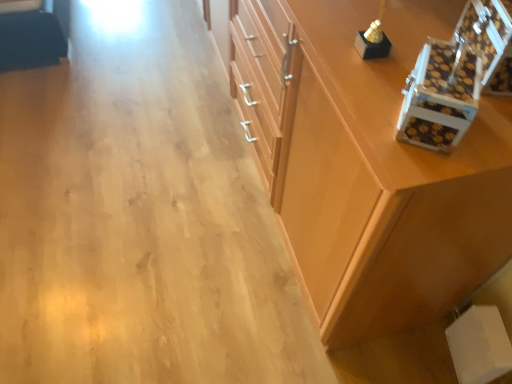
Question: Considering the relative positions of brown checkered box at upper right, which is the second box from left to right, and white textured box at upper right, marked as the 1th box in a left-to-right arrangement, in the image provided, is brown checkered box at upper right, which is the second box from left to right, in front of white textured box at upper right, marked as the 1th box in a left-to-right arrangement,?

Choices:
 (A) no
 (B) yes

Answer: (A)

Question: Is brown checkered box at upper right, which is the second box from left to right, taller than white textured box at upper right, marked as the 1th box in a left-to-right arrangement?

Choices:
 (A) yes
 (B) no

Answer: (A)

Question: Considering the relative sizes of brown checkered box at upper right, which appears as the first box when viewed from the right, and white textured box at upper right, marked as the 1th box in a left-to-right arrangement, in the image provided, is brown checkered box at upper right, which appears as the first box when viewed from the right, smaller than white textured box at upper right, marked as the 1th box in a left-to-right arrangement,?

Choices:
 (A) yes
 (B) no

Answer: (B)

Question: Considering the relative positions of brown checkered box at upper right, which is the second box from left to right, and white textured box at upper right, the second box in the right-to-left sequence, in the image provided, is brown checkered box at upper right, which is the second box from left to right, behind white textured box at upper right, the second box in the right-to-left sequence,?

Choices:
 (A) no
 (B) yes

Answer: (B)

Question: Is white textured box at upper right, marked as the 1th box in a left-to-right arrangement, completely or partially inside brown checkered box at upper right, which appears as the first box when viewed from the right?

Choices:
 (A) no
 (B) yes

Answer: (A)

Question: From their relative heights in the image, would you say brown checkered box at upper right, which appears as the first box when viewed from the right, is taller or shorter than white textured box at upper right, the second box in the right-to-left sequence?

Choices:
 (A) tall
 (B) short

Answer: (A)

Question: Considering the positions of brown checkered box at upper right, which is the second box from left to right, and white textured box at upper right, the second box in the right-to-left sequence, in the image, is brown checkered box at upper right, which is the second box from left to right, wider or thinner than white textured box at upper right, the second box in the right-to-left sequence,?

Choices:
 (A) thin
 (B) wide

Answer: (B)

Question: Which is correct: brown checkered box at upper right, which is the second box from left to right, is inside white textured box at upper right, the second box in the right-to-left sequence, or outside of it?

Choices:
 (A) outside
 (B) inside

Answer: (A)

Question: In the image, is brown checkered box at upper right, which appears as the first box when viewed from the right, positioned in front of or behind white textured box at upper right, marked as the 1th box in a left-to-right arrangement?

Choices:
 (A) behind
 (B) front

Answer: (A)

Question: From a real-world perspective, is brown checkered box at upper right, which appears as the first box when viewed from the right, positioned above or below wooden cabinet at center?

Choices:
 (A) below
 (B) above

Answer: (B)

Question: From the image's perspective, is brown checkered box at upper right, which appears as the first box when viewed from the right, above or below wooden cabinet at center?

Choices:
 (A) above
 (B) below

Answer: (B)

Question: In terms of size, does brown checkered box at upper right, which is the second box from left to right, appear bigger or smaller than wooden cabinet at center?

Choices:
 (A) big
 (B) small

Answer: (B)

Question: Considering their positions, is brown checkered box at upper right, which appears as the first box when viewed from the right, located in front of or behind wooden cabinet at center?

Choices:
 (A) behind
 (B) front

Answer: (A)

Question: In terms of width, does white textured box at upper right, the second box in the right-to-left sequence, look wider or thinner when compared to brown checkered box at upper right, which is the second box from left to right?

Choices:
 (A) thin
 (B) wide

Answer: (A)

Question: Looking at the image, does white textured box at upper right, marked as the 1th box in a left-to-right arrangement, seem bigger or smaller compared to brown checkered box at upper right, which appears as the first box when viewed from the right?

Choices:
 (A) small
 (B) big

Answer: (A)